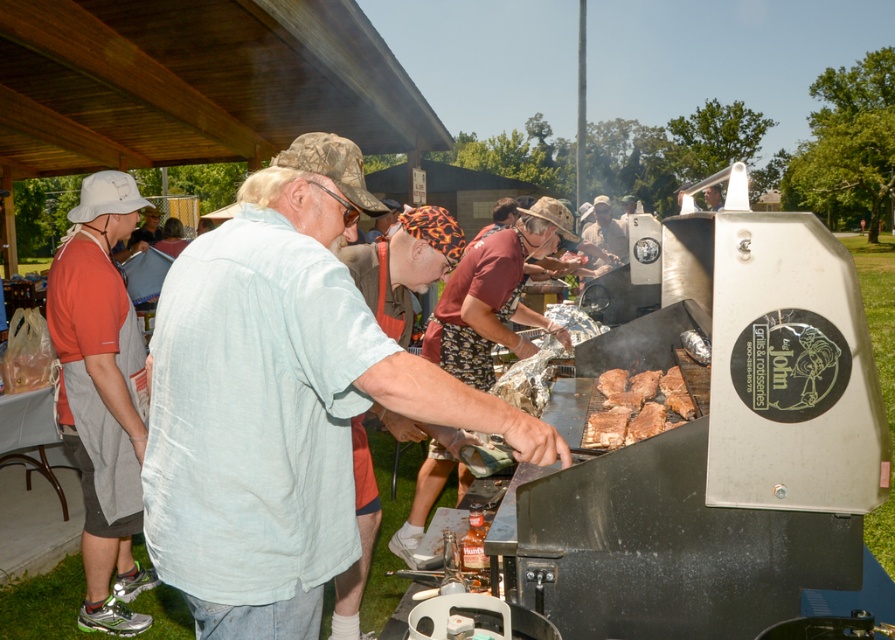
What is the color of the tshirt worn by the person at point [101,396]?

The orange tshirt at left is represented by point [101,396], so the color is orange.

What is the color of the clothing item located at the coordinates point (x=280, y=401)?

The light blue cotton shirt at center is located at point (x=280, y=401).